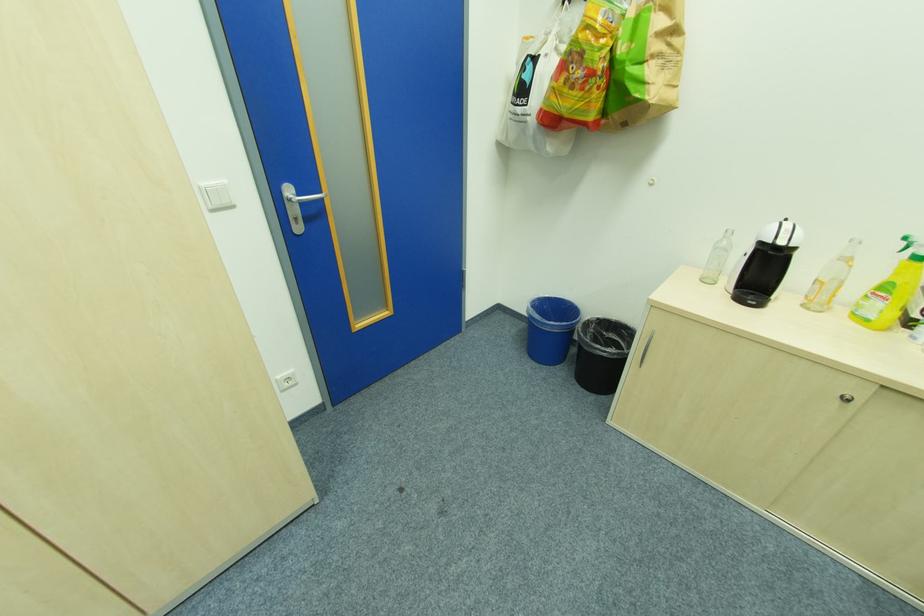
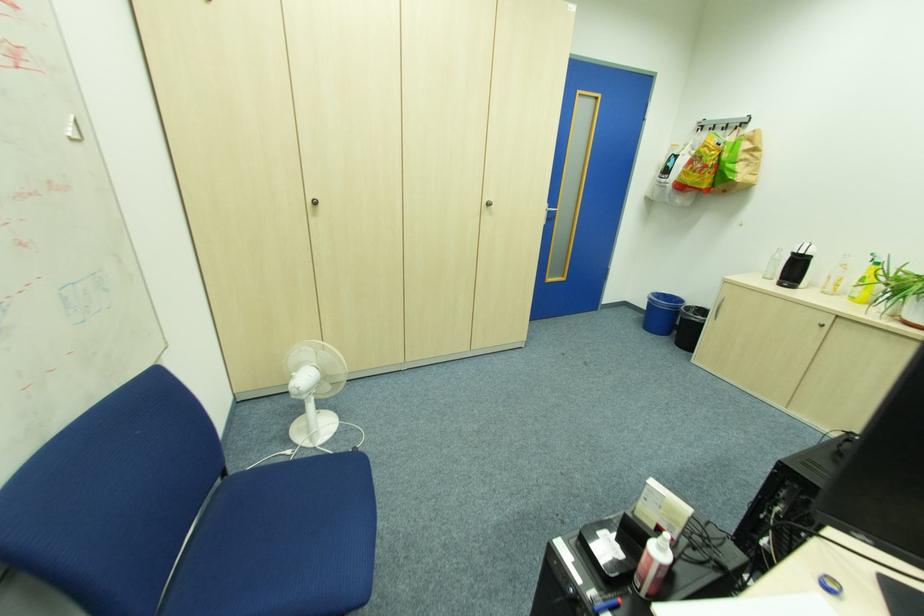
Question: The images are taken continuously from a first-person perspective. In which direction are you moving?

Choices:
 (A) Left
 (B) Right
 (C) Forward
 (D) Backward

Answer: (D)